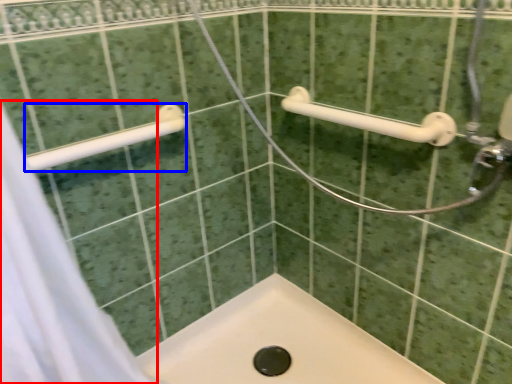
Question: Which object is further to the camera taking this photo, shower curtain (highlighted by a red box) or towel rack (highlighted by a blue box)?

Choices:
 (A) shower curtain
 (B) towel rack

Answer: (B)